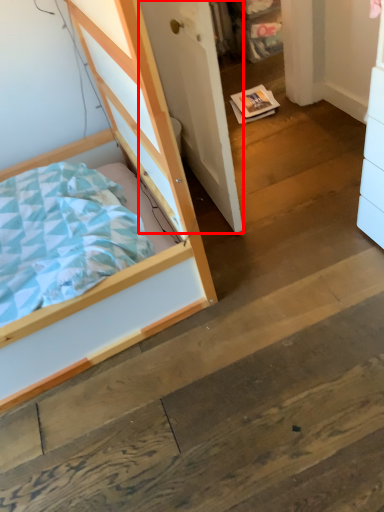
Question: Observing the image, what is the correct spatial positioning of door (annotated by the red box) in reference to bed?

Choices:
 (A) left
 (B) right

Answer: (B)